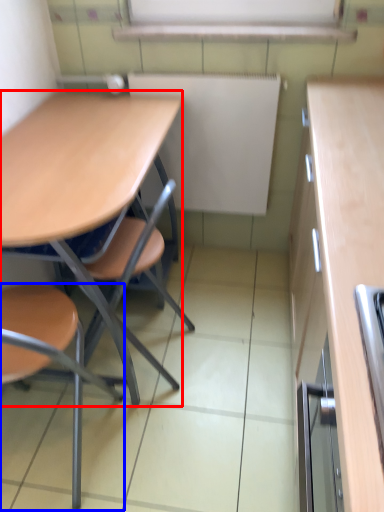
Question: Which of the following is the farthest to the observer, desk (highlighted by a red box) or chair (highlighted by a blue box)?

Choices:
 (A) desk
 (B) chair

Answer: (A)